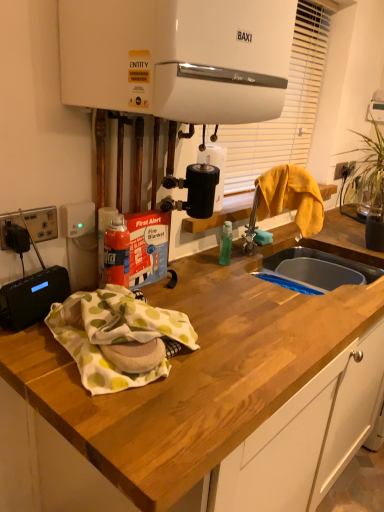
Question: Considering the relative sizes of yellow fabric at sink and wooden at center in the image provided, is yellow fabric at sink smaller than wooden at center?

Choices:
 (A) no
 (B) yes

Answer: (B)

Question: Is yellow fabric at sink positioned behind wooden at center?

Choices:
 (A) yes
 (B) no

Answer: (A)

Question: From a real-world perspective, does yellow fabric at sink stand above wooden at center?

Choices:
 (A) yes
 (B) no

Answer: (A)

Question: Is yellow fabric at sink facing away from wooden at center?

Choices:
 (A) no
 (B) yes

Answer: (A)

Question: Considering the relative sizes of yellow fabric at sink and wooden at center in the image provided, is yellow fabric at sink taller than wooden at center?

Choices:
 (A) no
 (B) yes

Answer: (A)

Question: From the image's perspective, is yellow fabric at sink on top of wooden at center?

Choices:
 (A) no
 (B) yes

Answer: (B)

Question: Does wooden at center appear on the left side of black plastic socket at left?

Choices:
 (A) no
 (B) yes

Answer: (A)

Question: From the image's perspective, does wooden at center appear higher than black plastic socket at left?

Choices:
 (A) yes
 (B) no

Answer: (B)

Question: Is wooden at center far away from black plastic socket at left?

Choices:
 (A) no
 (B) yes

Answer: (A)

Question: Is wooden at center positioned in front of black plastic socket at left?

Choices:
 (A) no
 (B) yes

Answer: (B)

Question: Is wooden at center looking in the opposite direction of black plastic socket at left?

Choices:
 (A) no
 (B) yes

Answer: (A)

Question: Does wooden at center have a smaller size compared to black plastic socket at left?

Choices:
 (A) no
 (B) yes

Answer: (A)

Question: Does white plastic blind at upper center come behind yellow fabric at sink?

Choices:
 (A) no
 (B) yes

Answer: (B)